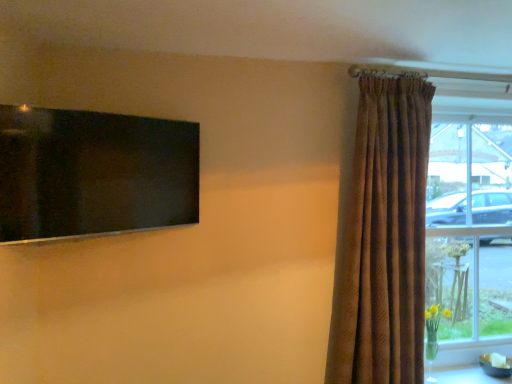
Question: From a real-world perspective, is clear glass window at right positioned under white glossy table at lower right based on gravity?

Choices:
 (A) no
 (B) yes

Answer: (A)

Question: Does clear glass window at right have a smaller size compared to white glossy table at lower right?

Choices:
 (A) yes
 (B) no

Answer: (B)

Question: Can you confirm if clear glass window at right is shorter than white glossy table at lower right?

Choices:
 (A) yes
 (B) no

Answer: (B)

Question: Does clear glass window at right contain white glossy table at lower right?

Choices:
 (A) no
 (B) yes

Answer: (A)

Question: From the image's perspective, is clear glass window at right beneath white glossy table at lower right?

Choices:
 (A) yes
 (B) no

Answer: (B)

Question: From the image's perspective, is clear glass window at right on white glossy table at lower right?

Choices:
 (A) no
 (B) yes

Answer: (B)

Question: Is black glossy screen at upper left taller than brown textured curtain at right?

Choices:
 (A) no
 (B) yes

Answer: (A)

Question: Is black glossy screen at upper left positioned in front of brown textured curtain at right?

Choices:
 (A) yes
 (B) no

Answer: (A)

Question: From a real-world perspective, does black glossy screen at upper left stand above brown textured curtain at right?

Choices:
 (A) no
 (B) yes

Answer: (B)

Question: Can we say black glossy screen at upper left lies outside brown textured curtain at right?

Choices:
 (A) yes
 (B) no

Answer: (A)

Question: Can you see black glossy screen at upper left touching brown textured curtain at right?

Choices:
 (A) yes
 (B) no

Answer: (B)

Question: From a real-world perspective, is black glossy screen at upper left under brown textured curtain at right?

Choices:
 (A) no
 (B) yes

Answer: (A)

Question: From a real-world perspective, does brown textured curtain at right stand above white glossy table at lower right?

Choices:
 (A) no
 (B) yes

Answer: (B)